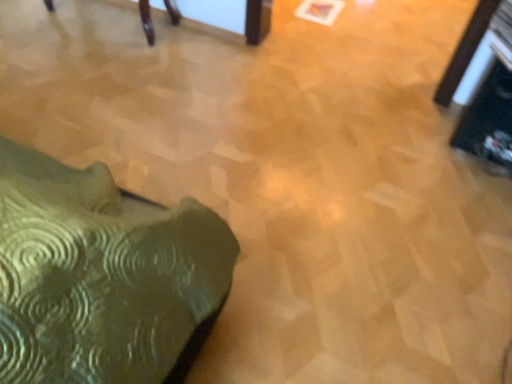
What do you see at coordinates (257, 21) in the screenshot?
I see `wooden chair leg at upper center` at bounding box center [257, 21].

The width and height of the screenshot is (512, 384). I want to click on wooden chair leg at upper center, so click(257, 21).

Find the location of a particular element. This screenshot has width=512, height=384. wooden chair leg at upper center is located at coordinates (257, 21).